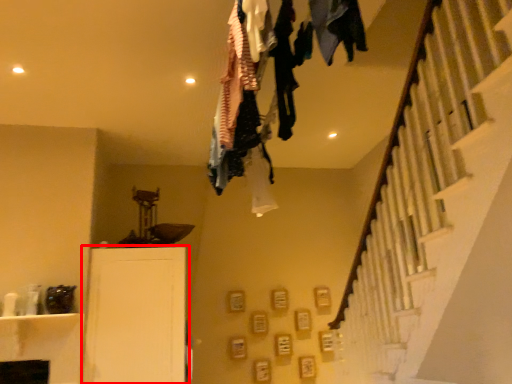
Question: From the image's perspective, where is furniture (annotated by the red box) located in relation to clothing in the image?

Choices:
 (A) above
 (B) below

Answer: (B)